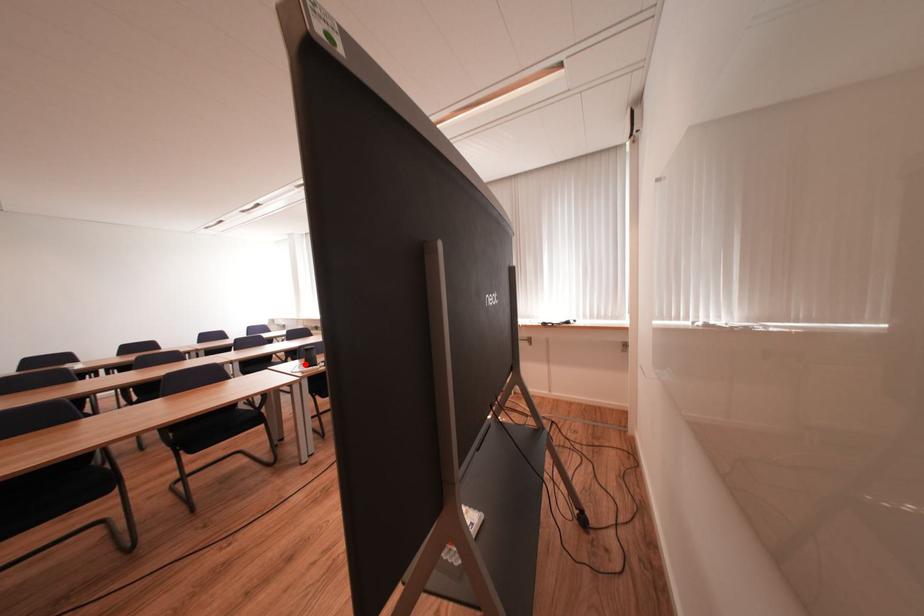
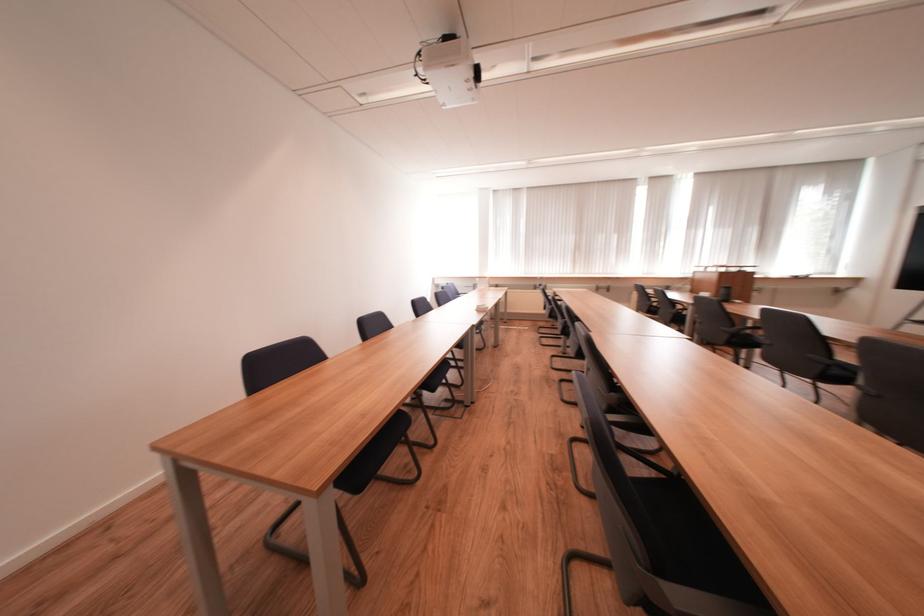
Question: I am providing you with two images of the same scene from different viewpoints. A red point is marked on the first image. At the location where the point appears in image 1, is it still visible in image 2?

Choices:
 (A) Yes
 (B) No

Answer: (B)